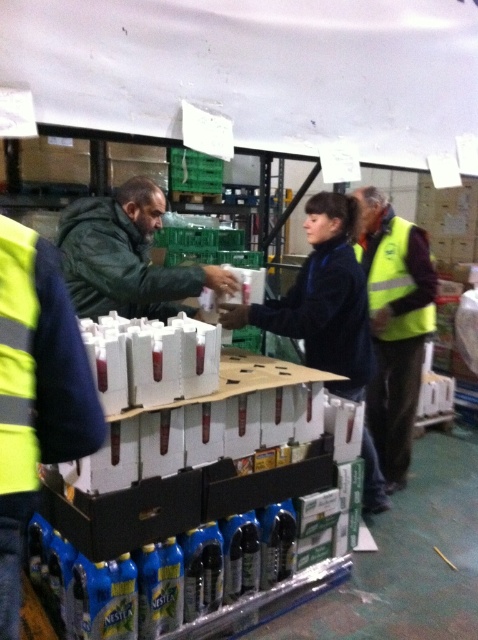
You are an inspector entering the warehouse and need to determine if the green matte jacket at center and the yellow reflective safety vest at right can fit side by side on a 1.2 meter wide shelf. Based on their widths, can they both fit without overlapping?

The green matte jacket at center might be wider than yellow reflective safety vest at right, so it is uncertain if they can fit side by right on the 1.2 meter wide shelf without overlapping. The exact widths are not provided, so further measurement is needed.

You are an inspector in this warehouse and need to determine which piece of safety equipment is higher positioned between the yellow reflective vest at right and the green matte jacket at center. Based on the scene, which one is taller?

The yellow reflective vest at right is taller than the green matte jacket at center according to the description.